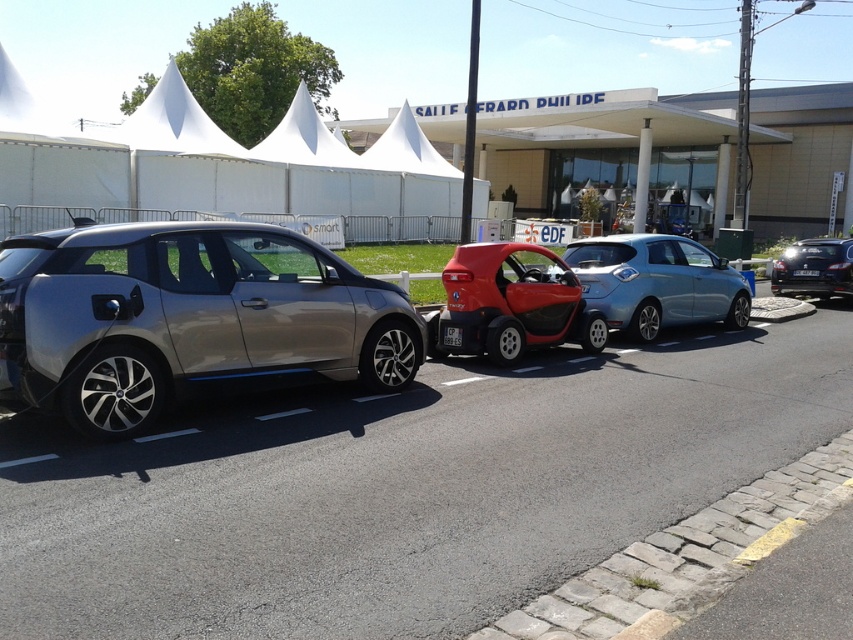
Does shiny red car at center have a greater height compared to metallic blue sedan at right?

No.

Which is in front, point (503, 364) or point (780, 284)?

Positioned in front is point (503, 364).

Between point (451, 310) and point (831, 243), which one is positioned behind?

The point (831, 243) is behind.

I want to click on shiny red car at center, so click(x=509, y=305).

Is metallic gray car at left shorter than satin silver car at center?

Correct, metallic gray car at left is not as tall as satin silver car at center.

Which is behind, point (10, 461) or point (28, 301)?

Positioned behind is point (28, 301).

Does point (776, 419) come closer to viewer compared to point (93, 298)?

No, it is behind (93, 298).

You are a GUI agent. You are given a task and a screenshot of the screen. Output one action in this format:
    pyautogui.click(x=<x>, y=<y>)
    Task: Click on the metallic gray car at left
    
    Given the screenshot: What is the action you would take?
    pyautogui.click(x=402, y=486)

Is satin silver car at center to the left of metallic blue sedan at right from the viewer's perspective?

Yes, satin silver car at center is to the left of metallic blue sedan at right.

Measure the distance between satin silver car at center and camera.

The distance of satin silver car at center from camera is 5.11 meters.

Find the location of a particular element. satin silver car at center is located at coordinates (186, 317).